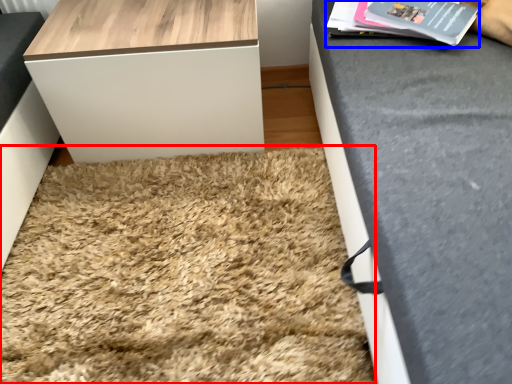
Question: Among these objects, which one is farthest to the camera, mat (highlighted by a red box) or magazine (highlighted by a blue box)?

Choices:
 (A) mat
 (B) magazine

Answer: (B)